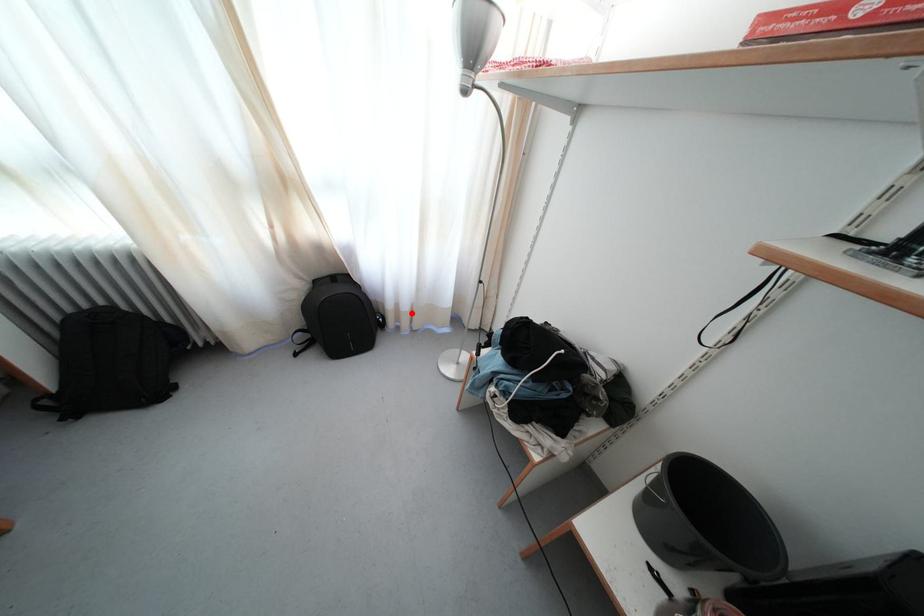
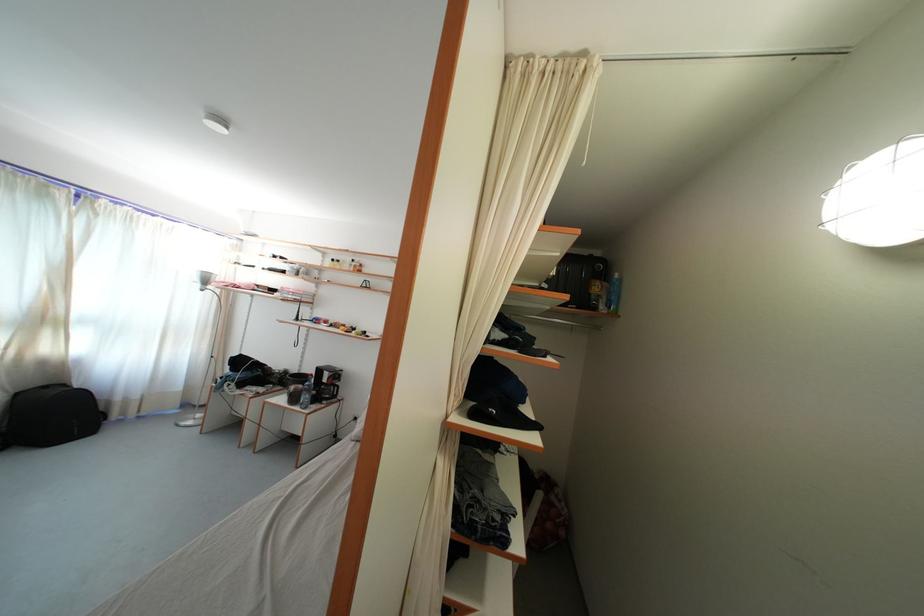
The point at the highlighted location is marked in the first image. Where is the corresponding point in the second image?

(141, 403)